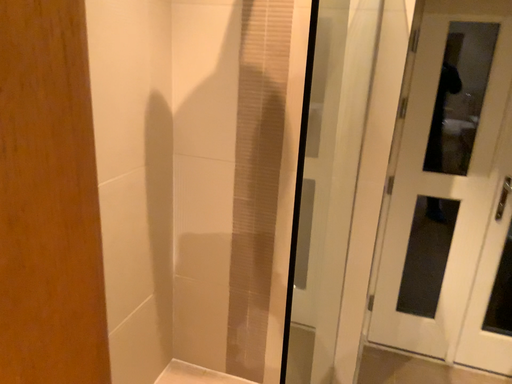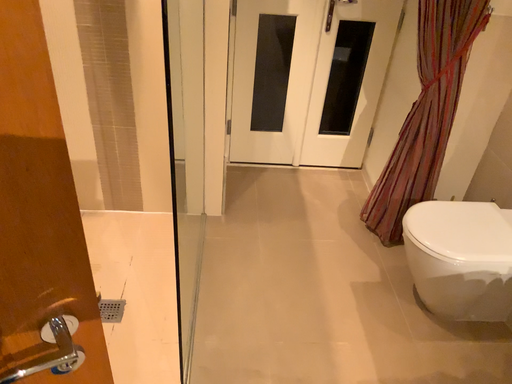
Question: Which way did the camera rotate in the video?

Choices:
 (A) rotated downward
 (B) rotated upward

Answer: (A)